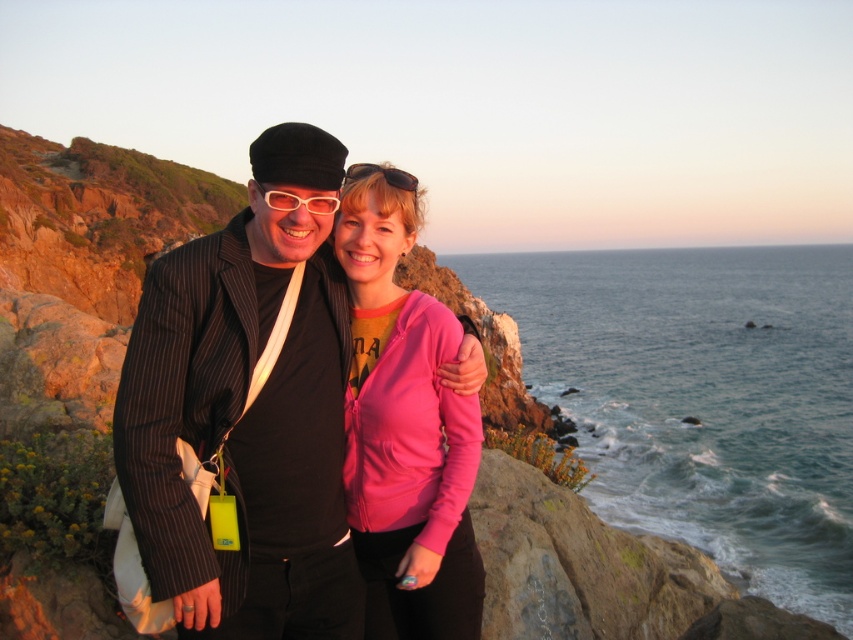
Between matte black suit at center and white plastic glasses at center, which one appears on the left side from the viewer's perspective?

Positioned to the left is matte black suit at center.

Does matte black suit at center have a lesser width compared to white plastic glasses at center?

Incorrect, matte black suit at center's width is not less than white plastic glasses at center's.

Does point (257, 512) come farther from viewer compared to point (292, 193)?

Yes, point (257, 512) is farther from viewer.

Where is `matte black suit at center`? The width and height of the screenshot is (853, 640). matte black suit at center is located at coordinates (247, 412).

Which of these two, white plastic glasses at center or pink matte sunglasses at center, stands shorter?

Standing shorter between the two is white plastic glasses at center.

The height and width of the screenshot is (640, 853). In order to click on white plastic glasses at center in this screenshot , I will do `click(299, 202)`.

Find the location of a particular element. white plastic glasses at center is located at coordinates [x=299, y=202].

Which is in front, point (242, 573) or point (345, 177)?

Point (242, 573) is more forward.

Which is behind, point (257, 138) or point (351, 168)?

The point (257, 138) is behind.

Which is in front, point (239, 518) or point (376, 170)?

Positioned in front is point (239, 518).

Find the location of a particular element. Image resolution: width=853 pixels, height=640 pixels. matte black suit at center is located at coordinates (247, 412).